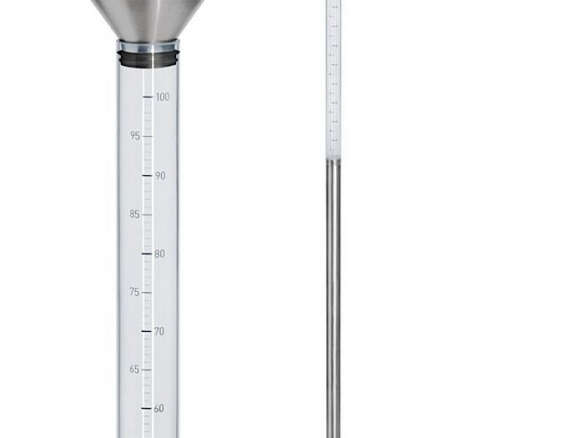
The height and width of the screenshot is (438, 584). I want to click on glass, so click(166, 198), click(331, 109).